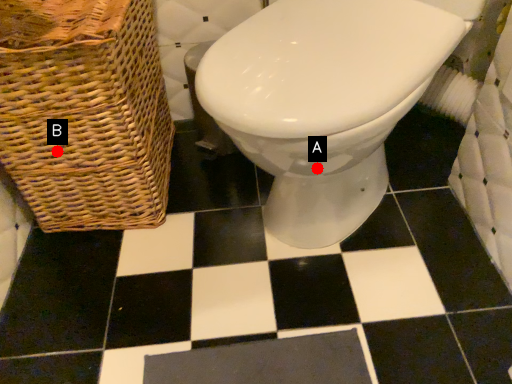
Question: Two points are circled on the image, labeled by A and B beside each circle. Which point is closer to the camera?

Choices:
 (A) A is closer
 (B) B is closer

Answer: (A)